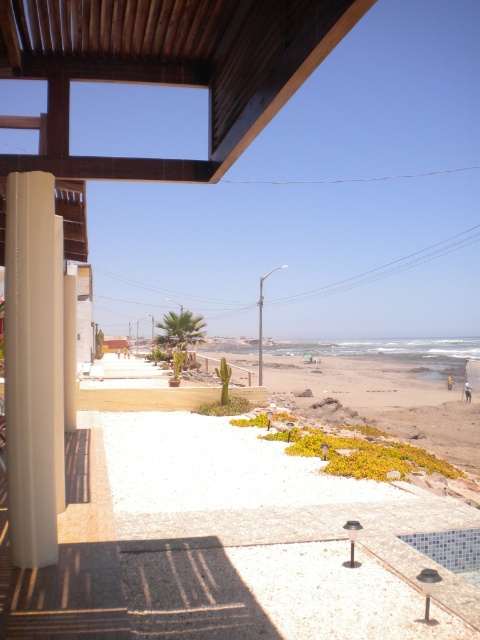
Is white glossy pillar at left wider than green succulent at center?

No, white glossy pillar at left is not wider than green succulent at center.

Between white glossy pillar at left and green succulent at center, which one is positioned higher?

Positioned higher is white glossy pillar at left.

What do you see at coordinates (29, 369) in the screenshot?
I see `white glossy pillar at left` at bounding box center [29, 369].

Locate an element on the screen. Image resolution: width=480 pixels, height=640 pixels. white glossy pillar at left is located at coordinates (29, 369).

Is green succulent at center shorter than beige textured balcony at left?

No, green succulent at center is not shorter than beige textured balcony at left.

Can you confirm if green succulent at center is wider than beige textured balcony at left?

Yes.

Who is more forward, (333, 362) or (83, 209)?

Positioned in front is point (83, 209).

Image resolution: width=480 pixels, height=640 pixels. I want to click on green succulent at center, so click(381, 401).

Between white glossy pillar at left and beige textured balcony at left, which one is positioned higher?

beige textured balcony at left is above.

Between white glossy pillar at left and beige textured balcony at left, which one appears on the right side from the viewer's perspective?

Positioned to the right is white glossy pillar at left.

Locate an element on the screen. Image resolution: width=480 pixels, height=640 pixels. white glossy pillar at left is located at coordinates [29, 369].